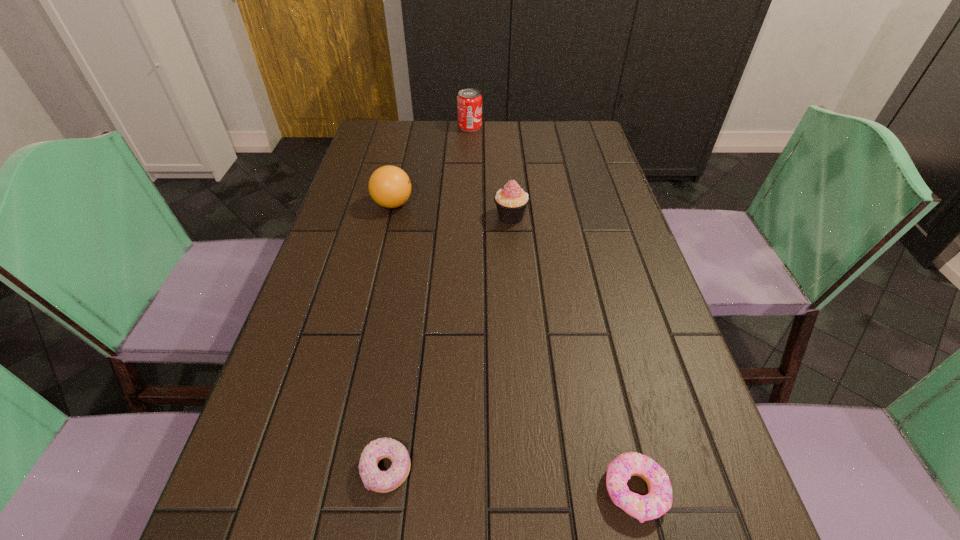
This screenshot has height=540, width=960. I want to click on free space located 0.360m on the back of the right doughnut, so click(x=588, y=295).

Locate an element on the screen. Image resolution: width=960 pixels, height=540 pixels. object at the far edge is located at coordinates (469, 101).

Find the location of a particular element. The height and width of the screenshot is (540, 960). object situated at the left edge is located at coordinates (389, 186).

Locate an element on the screen. The image size is (960, 540). object present at the right edge is located at coordinates (658, 501).

Identify the location of free space at the far edge. This screenshot has height=540, width=960. (435, 122).

At what (x,y) coordinates should I click in order to perform the action: click on vacant area at the left edge of the desktop. Please return your answer as a coordinate pair (x, y). Looking at the image, I should click on (313, 383).

Identify the location of free region at the right edge. The width and height of the screenshot is (960, 540). (618, 274).

Identify the location of free point at the far left corner. The height and width of the screenshot is (540, 960). (412, 127).

Image resolution: width=960 pixels, height=540 pixels. In the image, there is a desktop. Find the location of `vacant space at the far right corner`. vacant space at the far right corner is located at coordinates (586, 125).

The image size is (960, 540). Find the location of `free space that is in between the rightmost object and the left doughnut`. free space that is in between the rightmost object and the left doughnut is located at coordinates (511, 481).